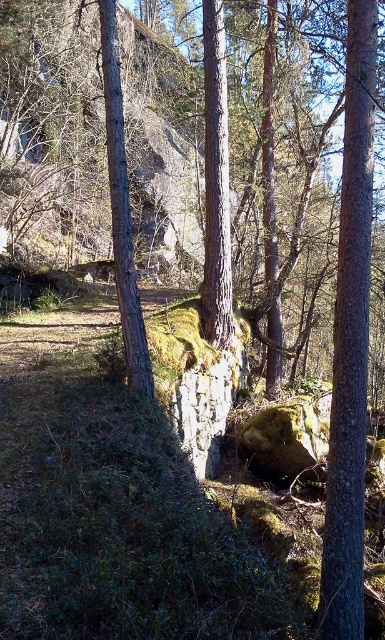
Is smooth brown tree trunk at right positioned in front of smooth gray bark at center?

Yes.

This screenshot has height=640, width=385. In order to click on smooth brown tree trunk at right in this screenshot , I will do `click(351, 342)`.

Is point (361, 104) less distant than point (122, 218)?

Yes, it is.

Identify the location of smooth brown tree trunk at right. (351, 342).

Can you confirm if smooth bark tree trunk at center is positioned to the left of smooth gray bark at center?

Incorrect, smooth bark tree trunk at center is not on the left side of smooth gray bark at center.

Is smooth bark tree trunk at center positioned behind smooth gray bark at center?

Yes.

I want to click on smooth bark tree trunk at center, so click(215, 184).

Is smooth brown tree trunk at right positioned in front of smooth bark tree trunk at center?

Yes, it is in front of smooth bark tree trunk at center.

Does point (351, 156) come closer to viewer compared to point (205, 196)?

Yes, it is.

Is point (344, 300) more distant than point (204, 328)?

No, it is not.

Where is `smooth brown tree trunk at right`? This screenshot has width=385, height=640. smooth brown tree trunk at right is located at coordinates (351, 342).